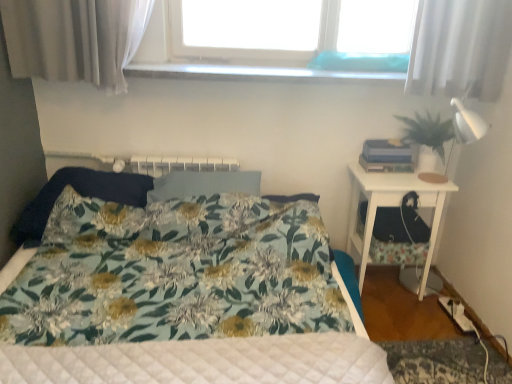
Question: Is green matte plant at right to the left or to the right of floral fabric bed at center in the image?

Choices:
 (A) right
 (B) left

Answer: (A)

Question: From a real-world perspective, is green matte plant at right physically located above or below floral fabric bed at center?

Choices:
 (A) above
 (B) below

Answer: (A)

Question: Based on their relative distances, which object is nearer to the green matte plant at right?

Choices:
 (A) dark blue fabric pillow at left, the first pillow when ordered from left to right
 (B) white sheer curtain at upper right
 (C) white glossy nightstand at right
 (D) floral fabric bed at center
 (E) clear glass window sill at upper center

Answer: (C)

Question: Based on their relative distances, which object is farther from the white glossy nightstand at right?

Choices:
 (A) floral fabric bed at center
 (B) white sheer curtain at upper right
 (C) fluffy fabric pillow at center, which is the first pillow in right-to-left order
 (D) clear glass window sill at upper center
 (E) green matte plant at right

Answer: (A)